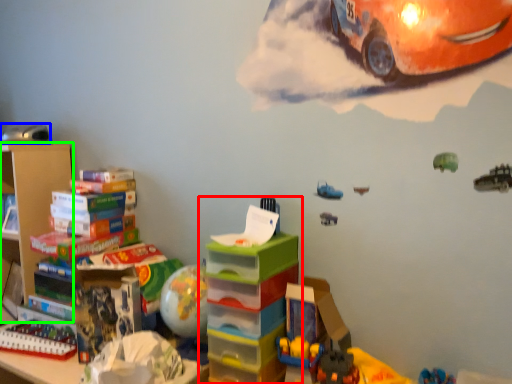
Question: Based on their relative distances, which object is nearer to toy (highlighted by a red box)? Choose from toy (highlighted by a blue box) and shelf (highlighted by a green box).

Choices:
 (A) toy
 (B) shelf

Answer: (B)